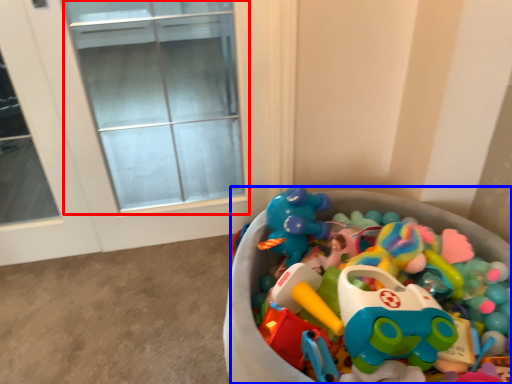
Question: Which point is further to the camera, glass door (highlighted by a red box) or toy (highlighted by a blue box)?

Choices:
 (A) glass door
 (B) toy

Answer: (A)